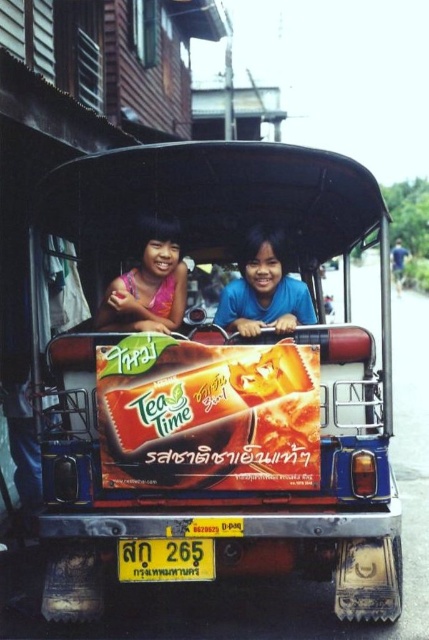
Identify the location of matte pink dress at center. (148, 284).

Can you confirm if matte pink dress at center is thinner than yellow plastic license plate at lower center?

No.

Which is behind, point (175, 225) or point (195, 540)?

Point (175, 225)

Image resolution: width=429 pixels, height=640 pixels. Identify the location of matte pink dress at center. (148, 284).

Is matte plastic tea bag at center behind blue fabric coach at right?

No, it is not.

Based on the photo, does matte plastic tea bag at center have a lesser height compared to blue fabric coach at right?

Yes, matte plastic tea bag at center is shorter than blue fabric coach at right.

Does point (226, 420) come farther from viewer compared to point (396, 250)?

No.

The width and height of the screenshot is (429, 640). I want to click on matte plastic tea bag at center, so click(x=208, y=413).

Can you confirm if matte plastic tea bag at center is taller than matte pink dress at center?

Indeed, matte plastic tea bag at center has a greater height compared to matte pink dress at center.

Measure the distance between matte plastic tea bag at center and matte pink dress at center.

matte plastic tea bag at center is 21.32 inches from matte pink dress at center.

Which is behind, point (220, 464) or point (166, 308)?

The point (166, 308) is more distant.

This screenshot has height=640, width=429. Identify the location of matte plastic tea bag at center. (208, 413).